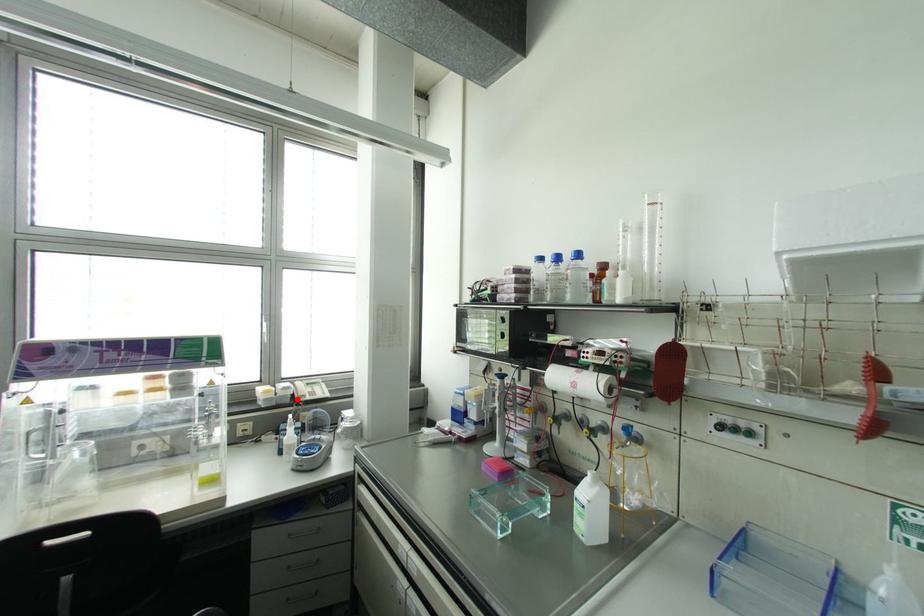
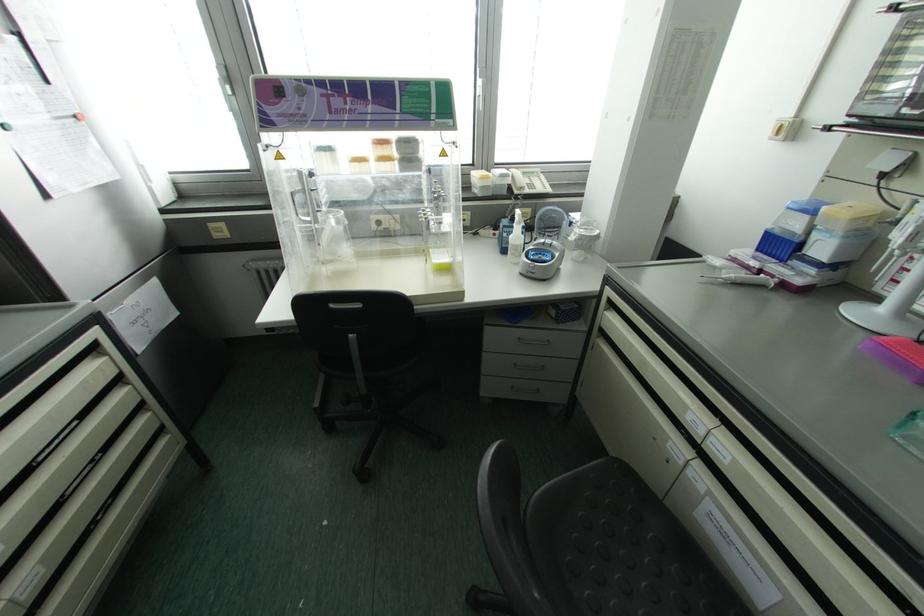
The point at the highlighted location is marked in the first image. Where is the corresponding point in the second image?

(515, 191)